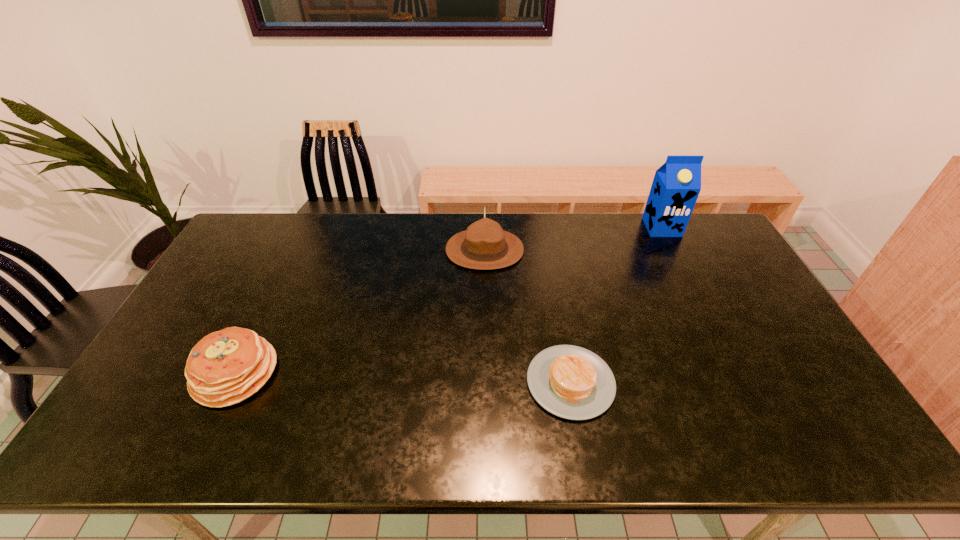
What are the coordinates of `vacant region that satisfies the following two spatial constraints: 1. with the cap open on the tallest object; 2. on the feather side of the fedora` in the screenshot? It's located at (673, 250).

Locate an element on the screen. The height and width of the screenshot is (540, 960). free space that satisfies the following two spatial constraints: 1. on the feather side of the fedora; 2. on the front side of the third tallest object is located at coordinates (486, 373).